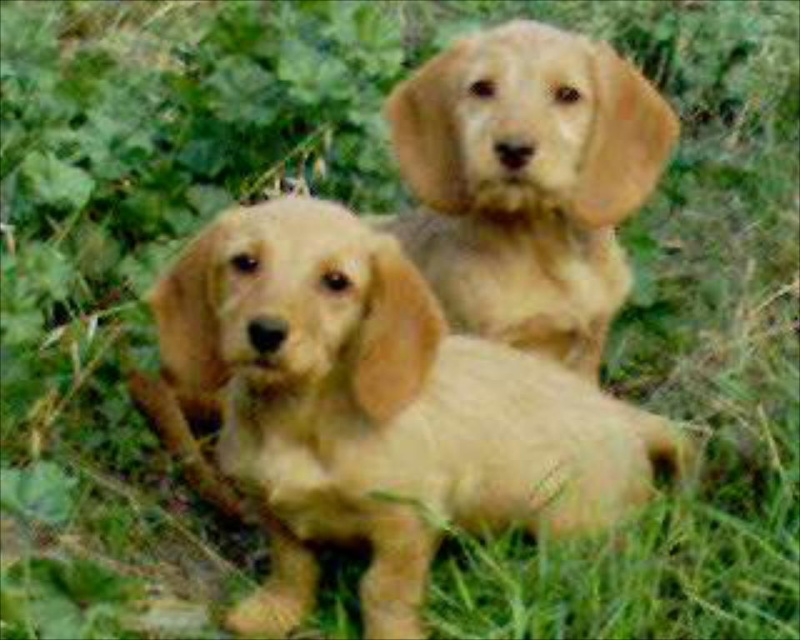
You are a dog trainer assessing the size of two golden puppies in a park. You see the golden fur puppy at center and the golden fur dog at upper center. Which one is taller?

The golden fur puppy at center is taller than the golden fur dog at upper center.

You are a photographer trying to capture a clear photo of the golden fur puppy at center. However, the golden fur dog at upper center is blocking your view. Can you adjust your position to take the photo without the dog in the way?

The golden fur puppy at center is positioned under the golden fur dog at upper center. By lowering your camera angle or moving to a lower position, you can aim to capture the puppy without the dog blocking the view.

From the picture: You are a photographer trying to capture a clear shot of the golden fur puppy at center. Given that your camera focuses on the point at coordinates 0.5, 0.5, will the puppy be in focus?

The golden fur puppy at center is located at point (372, 410), which is close to the camera focus point at (400, 320). Therefore, the puppy will be in focus.